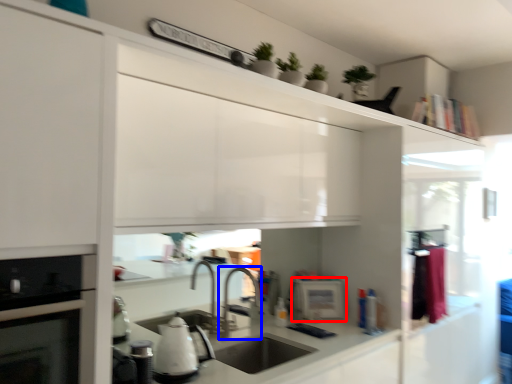
Question: Among these objects, which one is farthest to the camera, appliance (highlighted by a red box) or tap (highlighted by a blue box)?

Choices:
 (A) appliance
 (B) tap

Answer: (A)